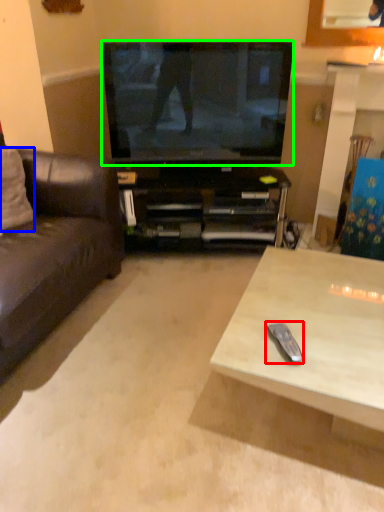
Question: Which object is the closest to the remote control (highlighted by a red box)? Choose among these: pillow (highlighted by a blue box) or television (highlighted by a green box).

Choices:
 (A) pillow
 (B) television

Answer: (B)